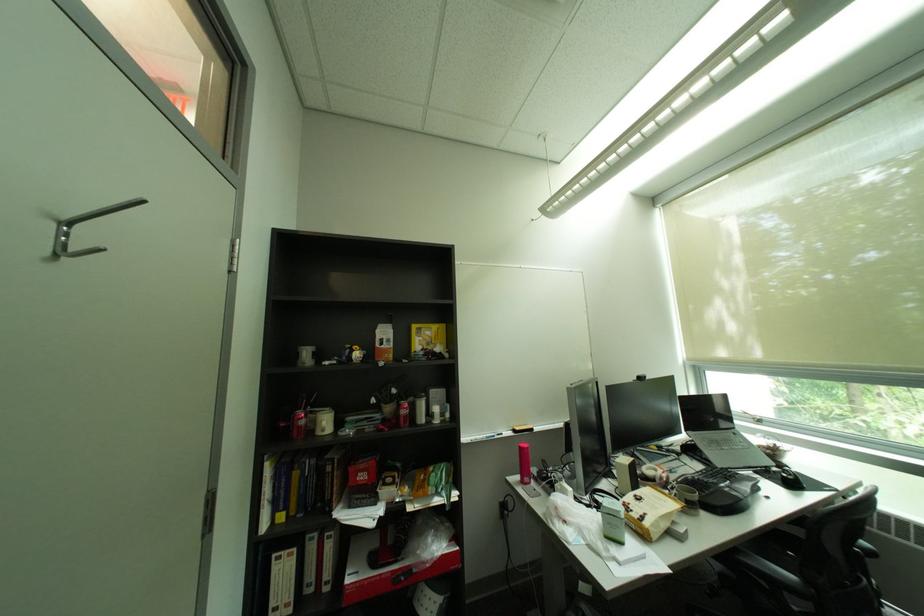
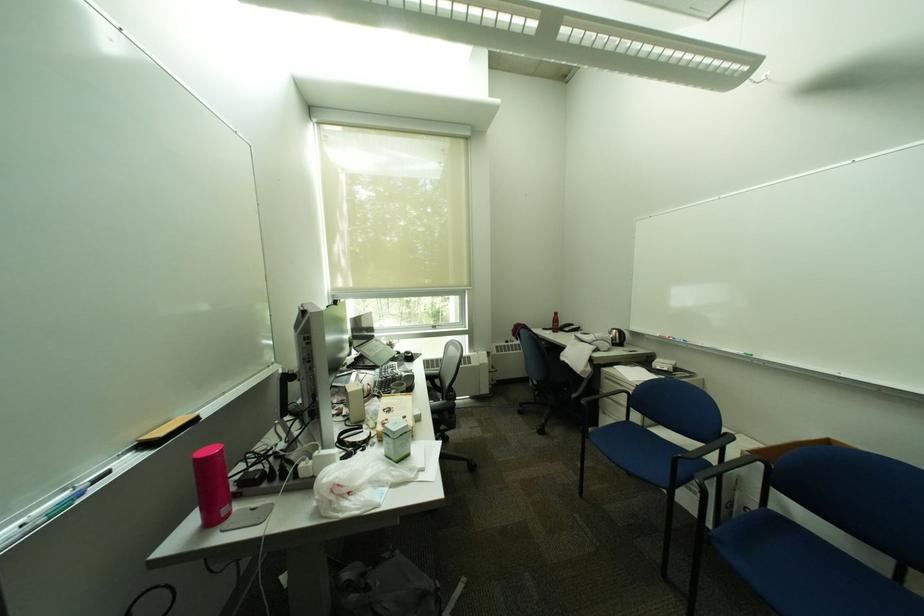
Locate, in the second image, the point that corresponds to (526,429) in the first image.

(155, 439)